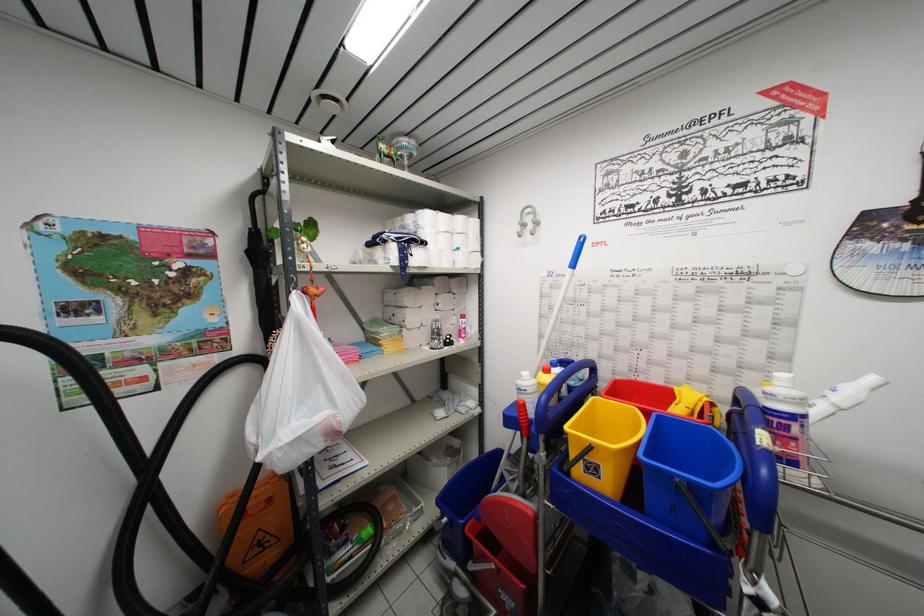
Find the location of a particular element. pink spray bottle trigger is located at coordinates (311, 288).